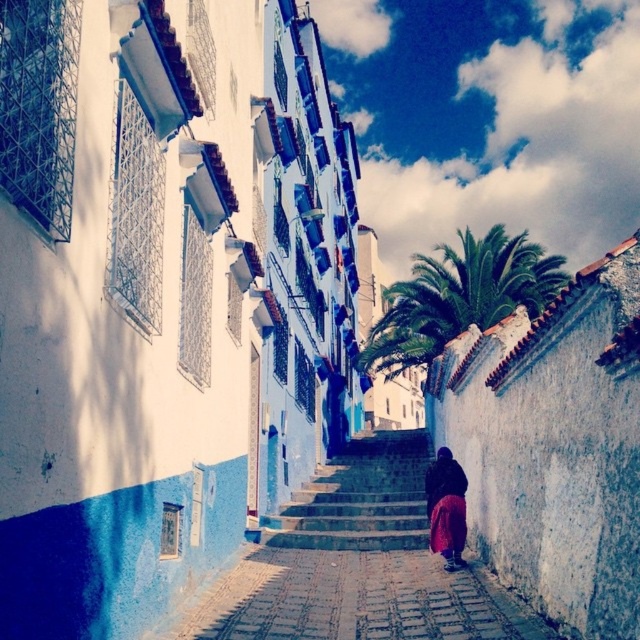
You are a tourist in this vibrant street scene. You see a green leafy palm at upper center and a dark purple fabric at center. Which object appears bigger in the image?

The green leafy palm at upper center appears bigger than the dark purple fabric at center because it has a larger size.

You are standing at the camera position and want to take a photo of the green leafy palm at upper center. If your camera can focus on objects up to 70 feet away, will you be able to capture it clearly?

The green leafy palm at upper center is 72.26 feet from the camera, which is beyond the camera focus range of 70 feet. Therefore, the palm will not be in focus and the photo will be blurry.

You are standing at the entrance of the street and want to take a photo of the green leafy palm at upper center and the blue stone stairs at center. Which object should you focus on first if you want to capture both in the same frame without moving the camera?

The green leafy palm at upper center is taller than the blue stone stairs at center, so you should focus on the green leafy palm at upper center first to ensure it fits within the frame.